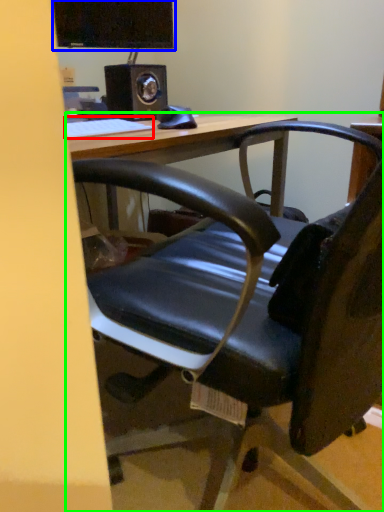
Question: Which object is positioned farthest from keyboard (highlighted by a red box)? Select from computer monitor (highlighted by a blue box) and table (highlighted by a green box).

Choices:
 (A) computer monitor
 (B) table

Answer: (A)